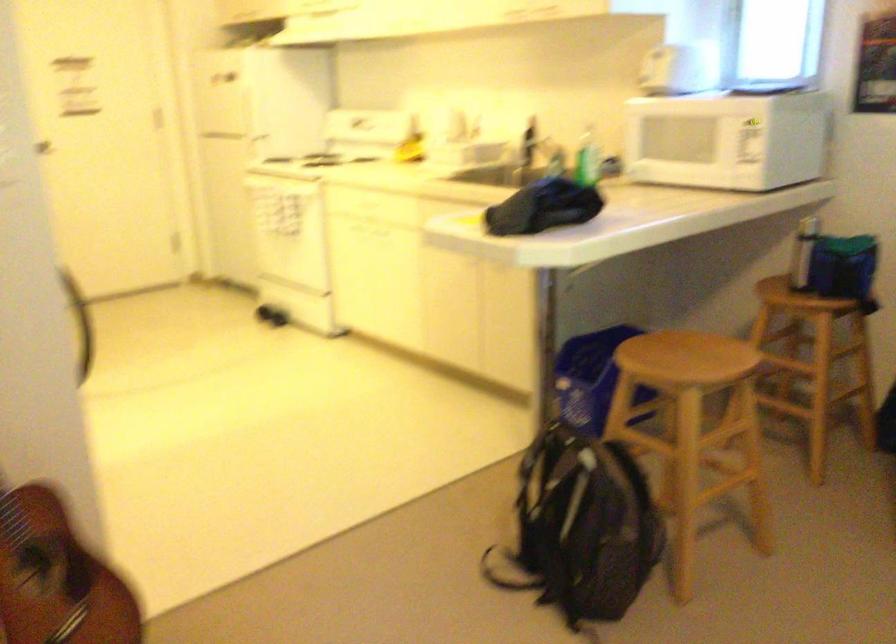
Question: The camera is either moving clockwise (left) or counter-clockwise (right) around the object. The first image is from the beginning of the video and the second image is from the end. Is the camera moving left or right when shooting the video?

Choices:
 (A) Left
 (B) Right

Answer: (B)